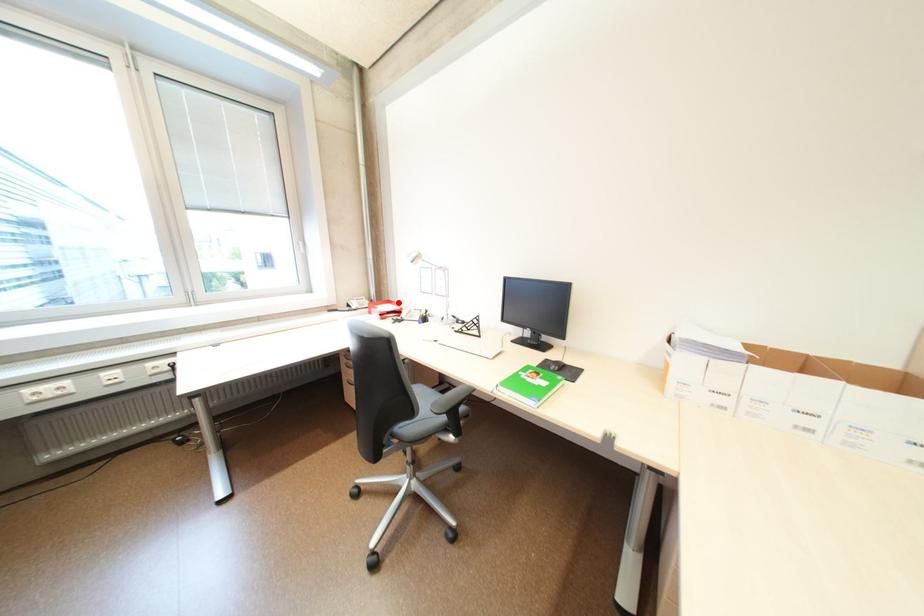
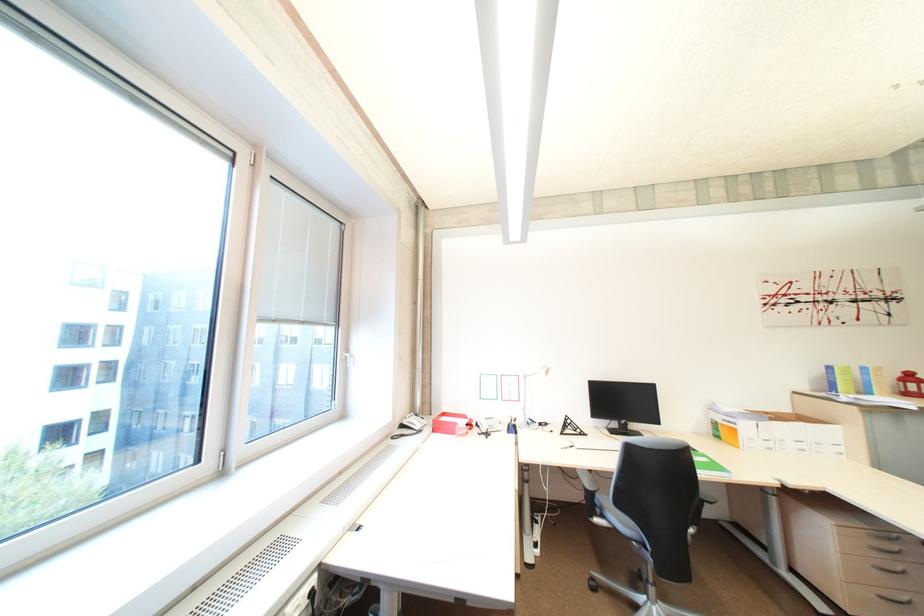
Locate, in the second image, the point that corresponds to the highlighted location in the first image.

(454, 415)